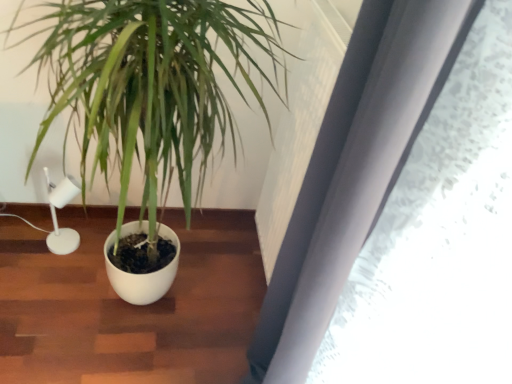
Find the location of `free space to the left of white matte lamp at left`. free space to the left of white matte lamp at left is located at coordinates (28, 231).